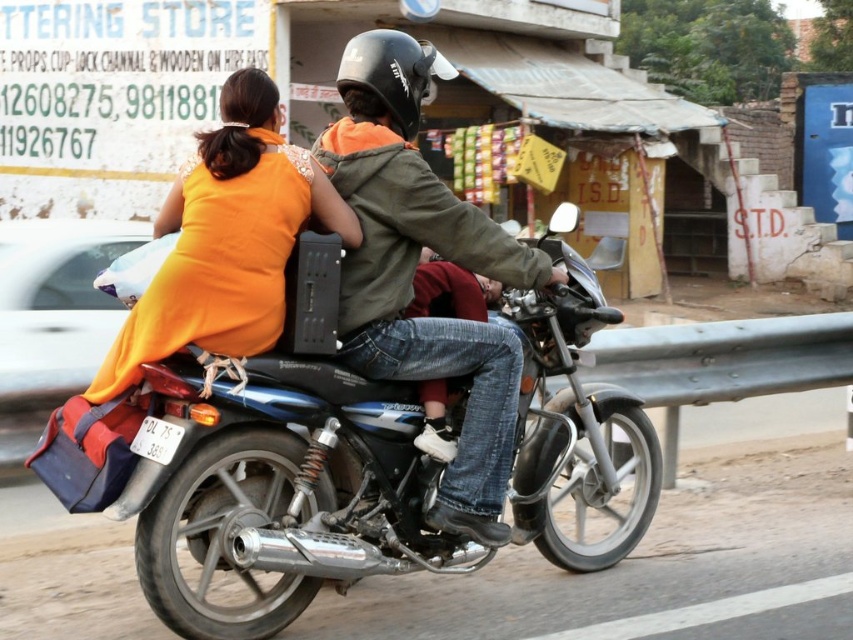
Question: Can you confirm if green matte jacket at center is thinner than orange fabric dress at upper left?

Choices:
 (A) no
 (B) yes

Answer: (A)

Question: Which is nearer to the shiny metallic motorcycle at center?

Choices:
 (A) green matte jacket at center
 (B) orange fabric dress at upper left

Answer: (B)

Question: Is shiny metallic motorcycle at center to the right of green matte jacket at center from the viewer's perspective?

Choices:
 (A) no
 (B) yes

Answer: (A)

Question: Among these objects, which one is farthest from the camera?

Choices:
 (A) orange fabric dress at upper left
 (B) shiny metallic motorcycle at center

Answer: (A)

Question: Does green matte jacket at center come in front of orange fabric dress at upper left?

Choices:
 (A) no
 (B) yes

Answer: (A)

Question: Which of the following is the closest to the observer?

Choices:
 (A) (260, 600)
 (B) (228, 292)

Answer: (B)